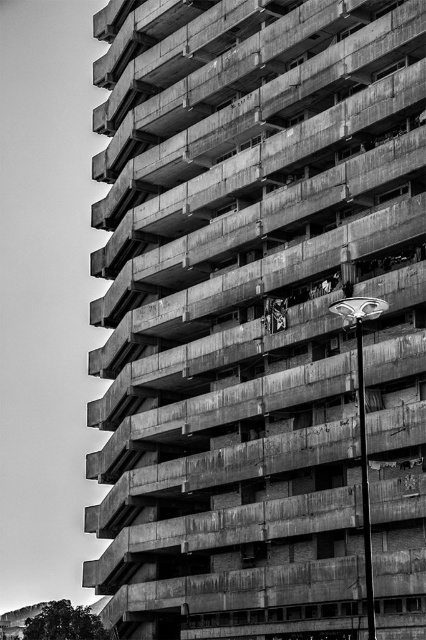
Question: Which of the following is the closest to the observer?

Choices:
 (A) metallic silver skateboard at center
 (B) metallic street sign at center-right

Answer: (B)

Question: Can you confirm if metallic street sign at center-right is smaller than metallic silver skateboard at center?

Choices:
 (A) no
 (B) yes

Answer: (A)

Question: Which point is closer to the camera taking this photo?

Choices:
 (A) (363, 433)
 (B) (270, 300)

Answer: (A)

Question: Which point appears closest to the camera in this image?

Choices:
 (A) (360, 358)
 (B) (279, 321)

Answer: (A)

Question: Does metallic street sign at center-right appear on the left side of metallic silver skateboard at center?

Choices:
 (A) no
 (B) yes

Answer: (A)

Question: Can you confirm if metallic street sign at center-right is positioned to the right of metallic silver skateboard at center?

Choices:
 (A) yes
 (B) no

Answer: (A)